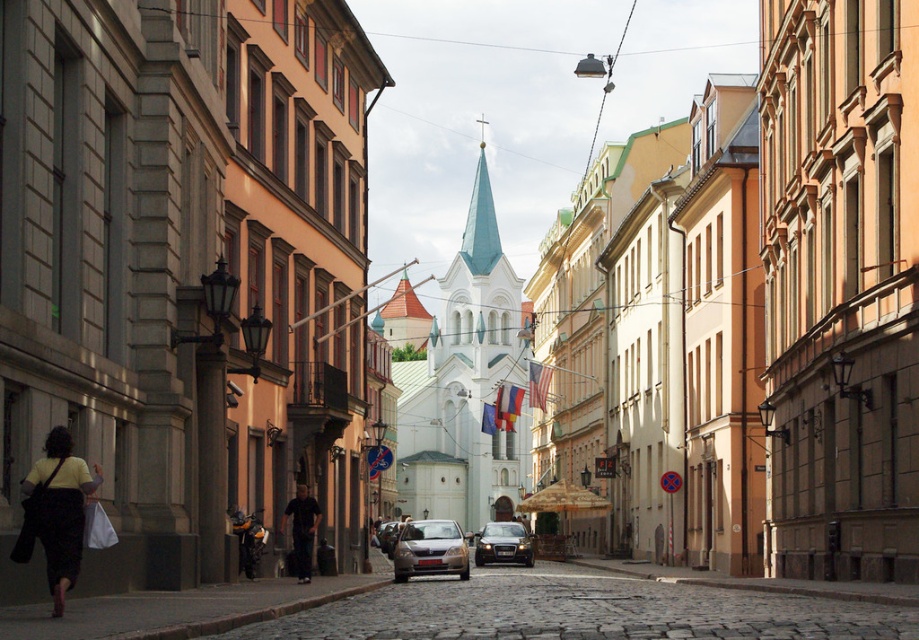
Question: Estimate the real-world distances between objects in this image. Which object is farther from the silver metallic sedan at center?

Choices:
 (A) matte yellow shirt at lower left
 (B) white stone church at center
 (C) dark blue jeans at center
 (D) satin black car at center

Answer: (B)

Question: Among these points, which one is nearest to the camera?

Choices:
 (A) (520, 355)
 (B) (389, 541)
 (C) (31, 515)
 (D) (502, 545)

Answer: (C)

Question: Is satin black car at center further to the viewer compared to blue fabric flag at center?

Choices:
 (A) no
 (B) yes

Answer: (A)

Question: In this image, where is white stone church at center located relative to matte yellow shirt at lower left?

Choices:
 (A) left
 (B) right

Answer: (B)

Question: Is satin black car at center wider than blue fabric flag at center?

Choices:
 (A) no
 (B) yes

Answer: (B)

Question: Which point is farther to the camera?

Choices:
 (A) (485, 451)
 (B) (398, 522)
 (C) (509, 531)

Answer: (A)